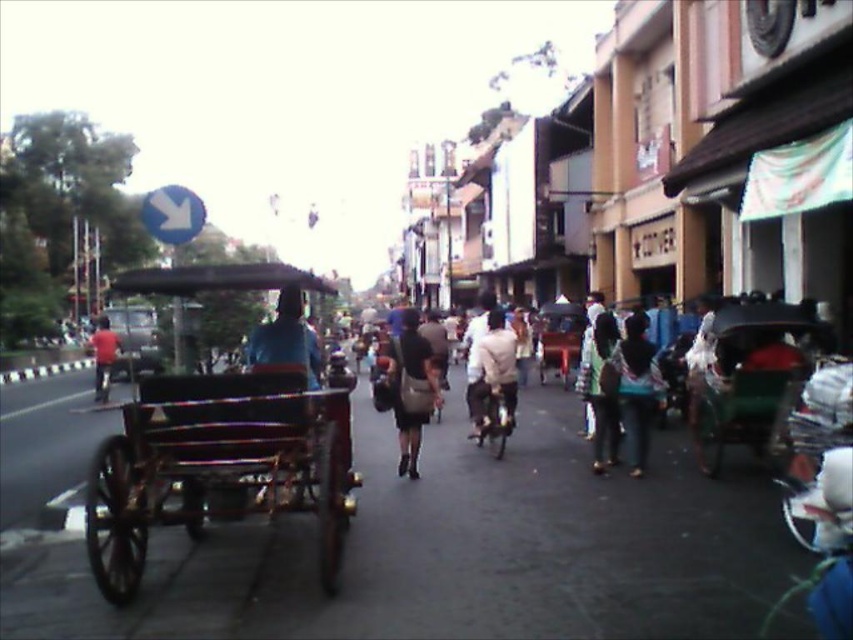
Is point (331, 392) closer to camera compared to point (755, 381)?

That is True.

Does wooden wagon at left have a greater width compared to green wooden cart at right?

Yes, wooden wagon at left is wider than green wooden cart at right.

Is point (216, 486) positioned behind point (706, 440)?

No, it is not.

In order to click on wooden wagon at left in this screenshot , I will do `click(218, 465)`.

Does matte black bag at center have a lesser width compared to red shirt at center?

Indeed, matte black bag at center has a lesser width compared to red shirt at center.

The width and height of the screenshot is (853, 640). What do you see at coordinates (601, 390) in the screenshot?
I see `matte black bag at center` at bounding box center [601, 390].

The height and width of the screenshot is (640, 853). In order to click on matte black bag at center in this screenshot , I will do `click(601, 390)`.

Who is more forward, (x=764, y=378) or (x=509, y=426)?

Positioned in front is point (x=764, y=378).

Can you confirm if green wooden cart at right is wider than light brown leather jacket at center?

Indeed, green wooden cart at right has a greater width compared to light brown leather jacket at center.

This screenshot has height=640, width=853. What are the coordinates of `green wooden cart at right` in the screenshot? It's located at (747, 376).